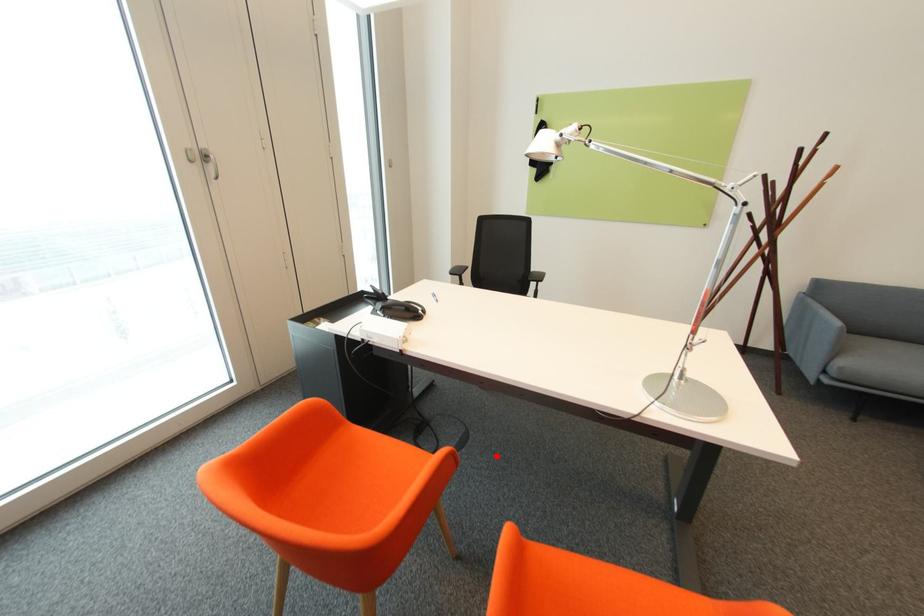
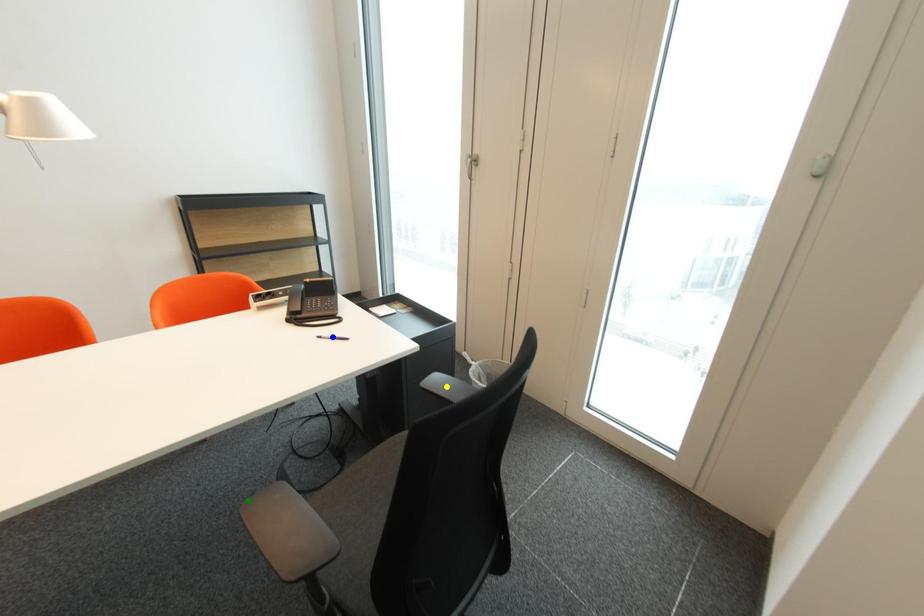
Question: I am providing you with two images of the same scene from different viewpoints. A red point is marked on the first image. You are given multiple points on the second image. In image 2, which mark is for the same physical point as the one in image 1?

Choices:
 (A) green point
 (B) yellow point
 (C) blue point

Answer: (A)